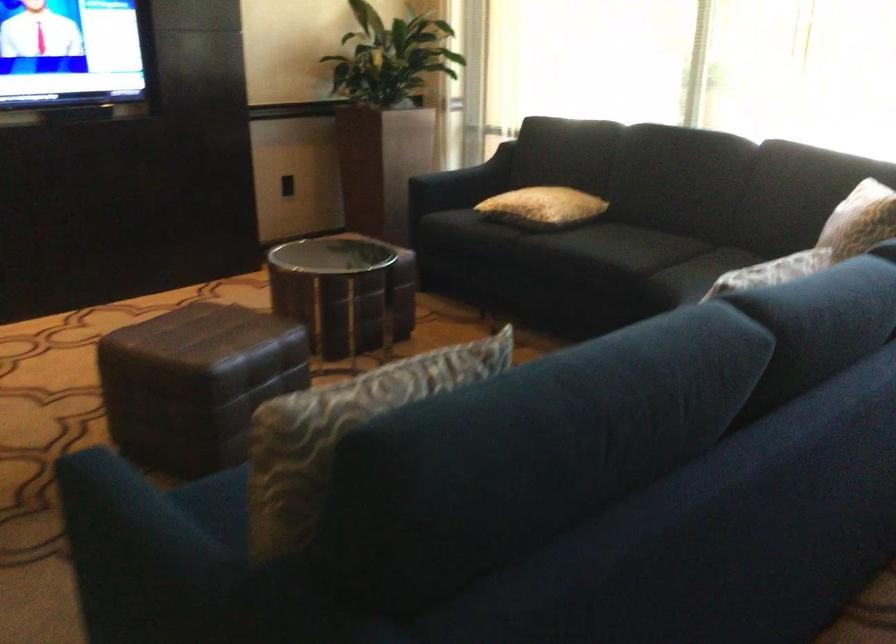
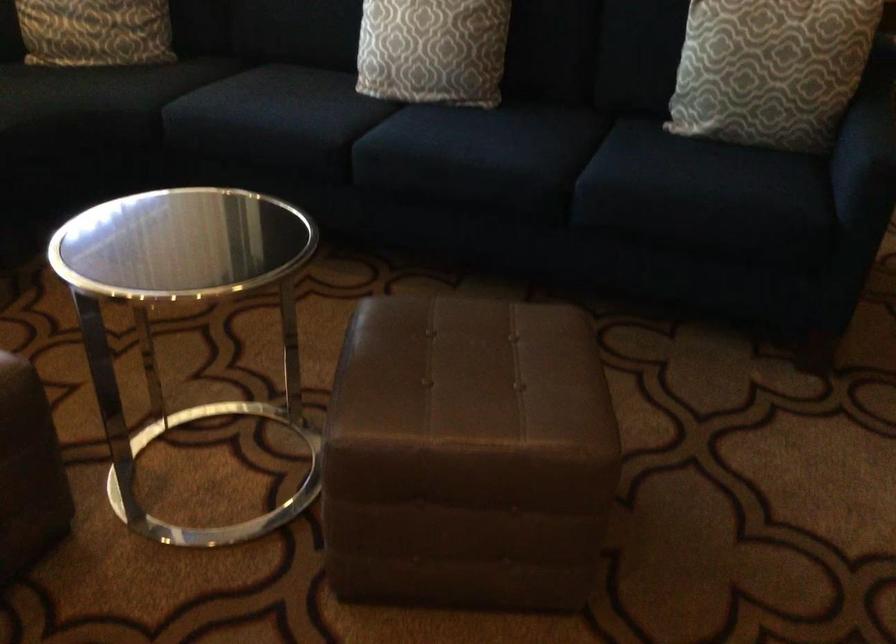
In the second image, find the point that corresponds to point (195, 383) in the first image.

(604, 324)